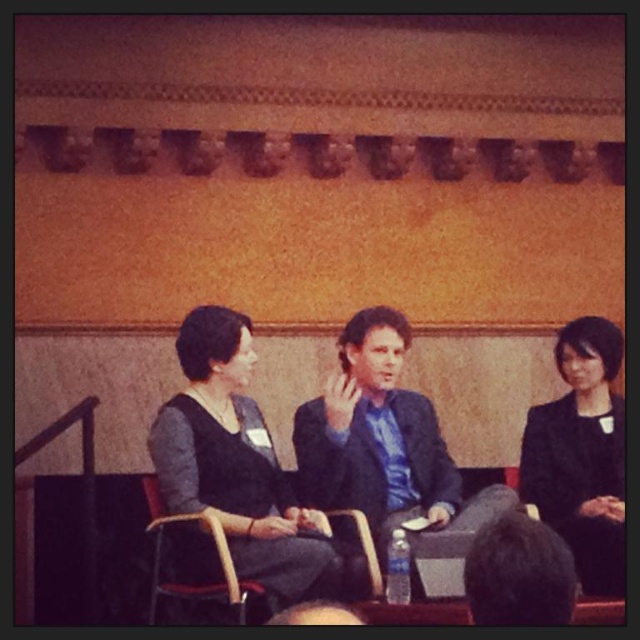
Is blue satin suit at center to the right of black matte blazer at right from the viewer's perspective?

No, blue satin suit at center is not to the right of black matte blazer at right.

Can you confirm if blue satin suit at center is shorter than black matte blazer at right?

Yes.

Identify the location of blue satin suit at center. (387, 449).

Image resolution: width=640 pixels, height=640 pixels. I want to click on blue satin suit at center, so click(x=387, y=449).

The height and width of the screenshot is (640, 640). Describe the element at coordinates (387, 449) in the screenshot. I see `blue satin suit at center` at that location.

Where is `blue satin suit at center`? This screenshot has height=640, width=640. blue satin suit at center is located at coordinates (387, 449).

The width and height of the screenshot is (640, 640). Find the location of `blue satin suit at center`. blue satin suit at center is located at coordinates (387, 449).

Is dark gray sweater at center closer to the viewer compared to wooden at left?

No, dark gray sweater at center is behind wooden at left.

In the scene shown: Between dark gray sweater at center and wooden at left, which one has more height?

dark gray sweater at center is taller.

This screenshot has height=640, width=640. Describe the element at coordinates (236, 465) in the screenshot. I see `dark gray sweater at center` at that location.

You are a GUI agent. You are given a task and a screenshot of the screen. Output one action in this format:
    pyautogui.click(x=<x>, y=<y>)
    Task: Click on the dark gray sweater at center
    
    Given the screenshot: What is the action you would take?
    pyautogui.click(x=236, y=465)